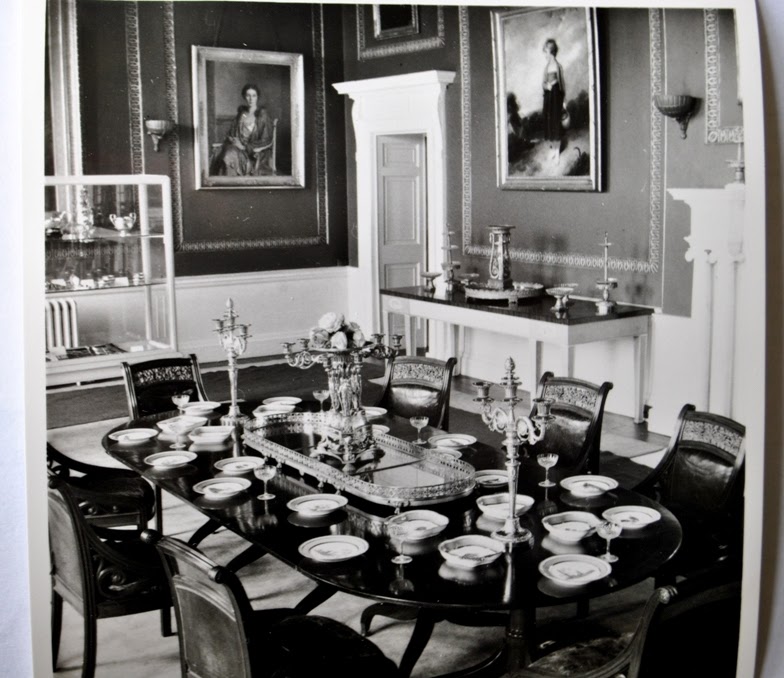
Find the location of a particular element. This screenshot has width=784, height=678. centerpiece is located at coordinates (347, 405).